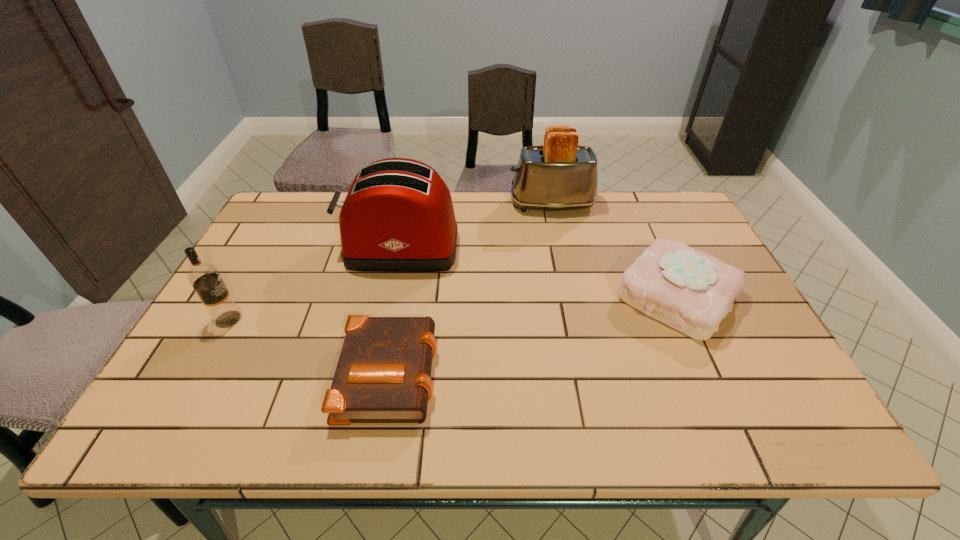
Identify the location of free spot located 0.240m on the label of the leftmost object. (341, 319).

Identify the location of vacant point located on the back of the cake. (639, 214).

The width and height of the screenshot is (960, 540). I want to click on vacant space located 0.120m on the spine side of the shortest object, so click(491, 371).

Locate an element on the screen. Image resolution: width=960 pixels, height=540 pixels. object situated at the near edge is located at coordinates (383, 373).

At what (x,y) coordinates should I click in order to perform the action: click on object that is at the left edge. Please return your answer as a coordinate pair (x, y). This screenshot has width=960, height=540. Looking at the image, I should click on (205, 278).

What are the coordinates of `object located in the right edge section of the desktop` in the screenshot? It's located at (691, 291).

Locate an element on the screen. This screenshot has height=540, width=960. vacant point at the far edge is located at coordinates tap(568, 211).

Image resolution: width=960 pixels, height=540 pixels. Find the location of `blank area at the near edge`. blank area at the near edge is located at coordinates 662,405.

Identify the location of vacant space at the left edge. The width and height of the screenshot is (960, 540). (262, 280).

Where is `free region at the right edge of the desktop`? free region at the right edge of the desktop is located at coordinates (692, 241).